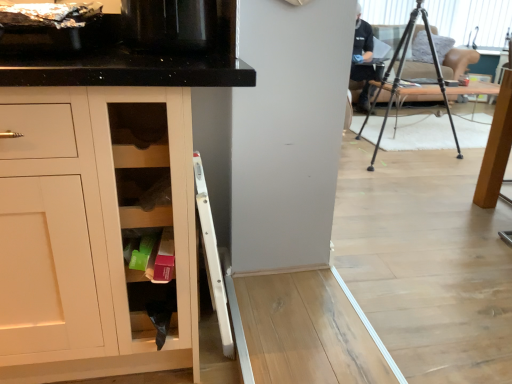
Question: Is black glossy microwave at upper left positioned with its back to light brown wooden table at right?

Choices:
 (A) no
 (B) yes

Answer: (A)

Question: Is black glossy microwave at upper left positioned in front of light brown wooden table at right?

Choices:
 (A) no
 (B) yes

Answer: (B)

Question: Considering the relative sizes of black glossy microwave at upper left and light brown wooden table at right in the image provided, is black glossy microwave at upper left wider than light brown wooden table at right?

Choices:
 (A) no
 (B) yes

Answer: (A)

Question: From the image's perspective, is black glossy microwave at upper left on top of light brown wooden table at right?

Choices:
 (A) no
 (B) yes

Answer: (B)

Question: Could you tell me if black glossy microwave at upper left is facing light brown wooden table at right?

Choices:
 (A) no
 (B) yes

Answer: (A)

Question: Considering the positions of light brown wooden table at right and wooden shelves at lower center in the image, is light brown wooden table at right wider or thinner than wooden shelves at lower center?

Choices:
 (A) wide
 (B) thin

Answer: (A)

Question: Considering their positions, is light brown wooden table at right located in front of or behind wooden shelves at lower center?

Choices:
 (A) front
 (B) behind

Answer: (B)

Question: From the image's perspective, is light brown wooden table at right positioned above or below wooden shelves at lower center?

Choices:
 (A) below
 (B) above

Answer: (B)

Question: From their relative heights in the image, would you say light brown wooden table at right is taller or shorter than wooden shelves at lower center?

Choices:
 (A) short
 (B) tall

Answer: (B)

Question: Visually, is wooden shelves at lower center positioned to the left or to the right of black glossy microwave at upper left?

Choices:
 (A) left
 (B) right

Answer: (A)

Question: In terms of width, does wooden shelves at lower center look wider or thinner when compared to black glossy microwave at upper left?

Choices:
 (A) wide
 (B) thin

Answer: (B)

Question: Would you say wooden shelves at lower center is inside or outside black glossy microwave at upper left?

Choices:
 (A) outside
 (B) inside

Answer: (A)

Question: From their relative heights in the image, would you say wooden shelves at lower center is taller or shorter than black glossy microwave at upper left?

Choices:
 (A) short
 (B) tall

Answer: (A)

Question: In the image, is light brown wooden table at right on the left side or the right side of black glossy microwave at upper left?

Choices:
 (A) left
 (B) right

Answer: (B)

Question: In the image, is light brown wooden table at right positioned in front of or behind black glossy microwave at upper left?

Choices:
 (A) front
 (B) behind

Answer: (B)